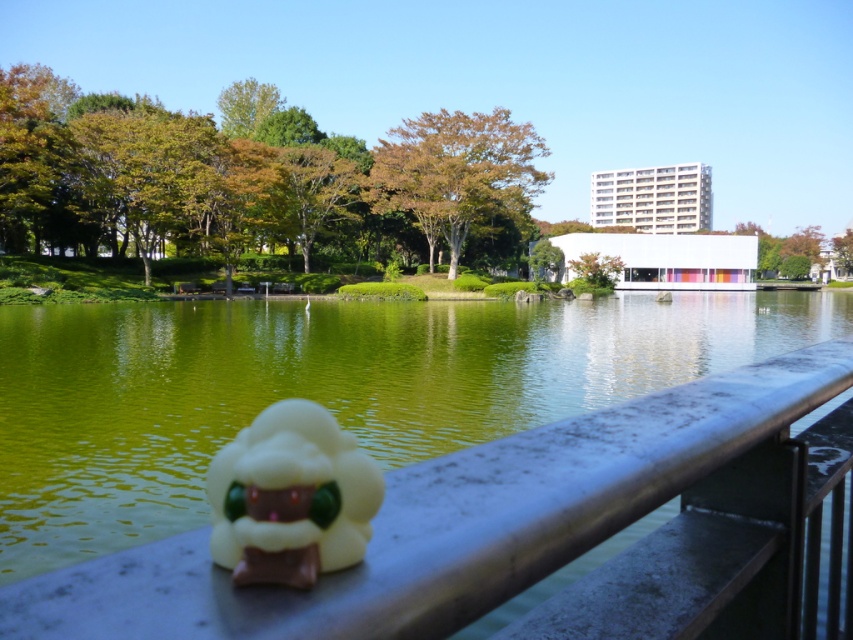
You are a delivery robot with a width of 18 inches. You need to navigate through the space between the metallic gray rail at lower center and the white matte plush toy at lower center. Can you fit through the gap without touching either object?

The gap between the metallic gray rail at lower center and the white matte plush toy at lower center is 18.85 inches. Since the robot is 18 inches wide, it can fit through the gap as there is enough space to pass without touching either object.

You are standing at the center of the image and want to place a new decorative item exactly where the metallic gray rail at lower center is located. According to the coordinates provided, what are the exact coordinates where you should place your item?

The exact coordinates for placing the decorative item should be at point (450, 522), where the metallic gray rail at lower center is positioned.